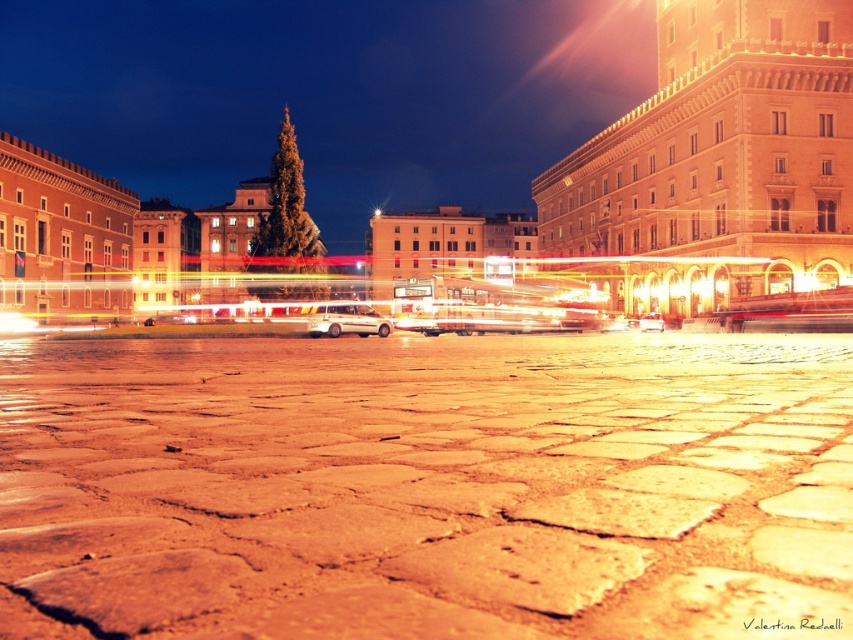
You are standing in the city square and want to take a photo of both point (659, 524) and point (650, 323). Which point should you focus on first to ensure both are in clear view?

You should focus on point (659, 524) first because it is closer to the camera than point (650, 323), ensuring both points are in focus when using a camera with a fixed focal length.

You are standing on the cobblestone pavement in the foreground of the urban scene. You notice two squares in the midground, the brown stone square at center and the smooth stone square at center. Which one is directly above the other?

The brown stone square at center is positioned under the smooth stone square at center, so the smooth stone square at center is directly above the brown stone square at center.

You are a delivery driver who needs to park your white matte van at center in the brown stone square at center. Can you park the van there without it overlapping the square?

The brown stone square at center is located below the white matte van at center, so the van is already positioned over the square. To park without overlapping, you might need to move the van to a different area where it doesn